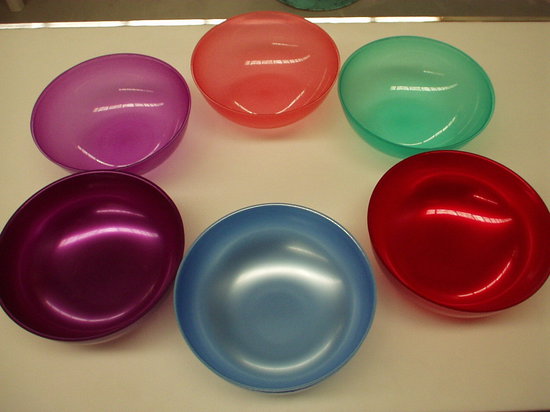
What are the coordinates of `light pink bowl` in the screenshot? It's located at (236, 50).